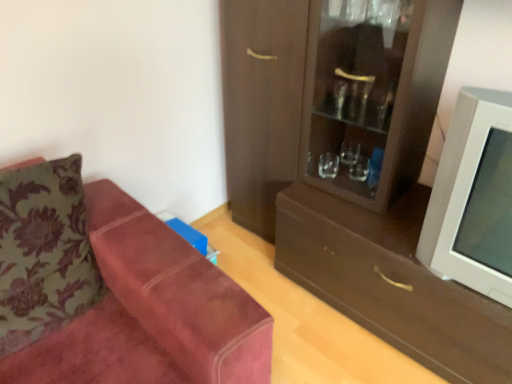
Question: From the image's perspective, is suede couch at left above or below velvet floral pillow at left?

Choices:
 (A) above
 (B) below

Answer: (B)

Question: Is suede couch at left spatially inside velvet floral pillow at left, or outside of it?

Choices:
 (A) inside
 (B) outside

Answer: (B)

Question: Which is farther from the brown matte drawer at center?

Choices:
 (A) suede couch at left
 (B) velvet floral pillow at left
 (C) matte brown cabinet at right
 (D) white plastic television at right

Answer: (B)

Question: Based on their relative distances, which object is farther from the brown matte drawer at center?

Choices:
 (A) velvet floral pillow at left
 (B) suede couch at left
 (C) matte brown cabinet at right
 (D) white plastic television at right

Answer: (A)